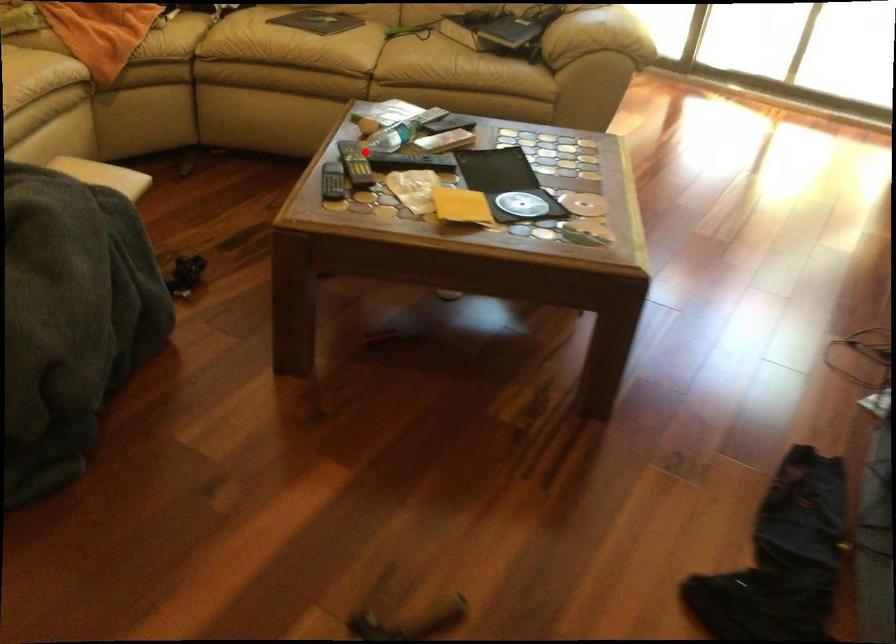
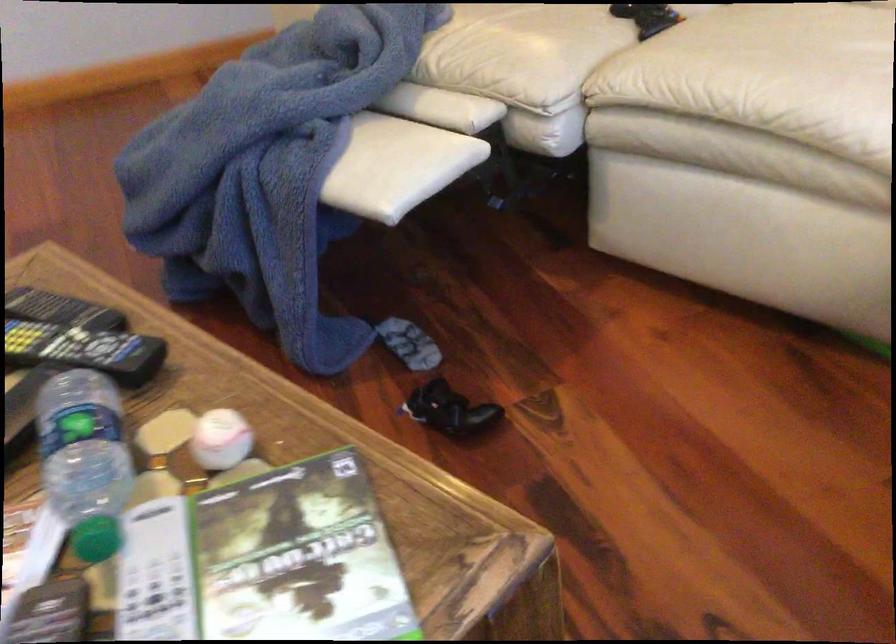
Question: I am providing you with two images of the same scene from different viewpoints. Image1 has a red point marked. In image2, the corresponding 3D location appears at what relative position? Reply with the corresponding letter.

Choices:
 (A) Closer
 (B) Farther

Answer: (A)